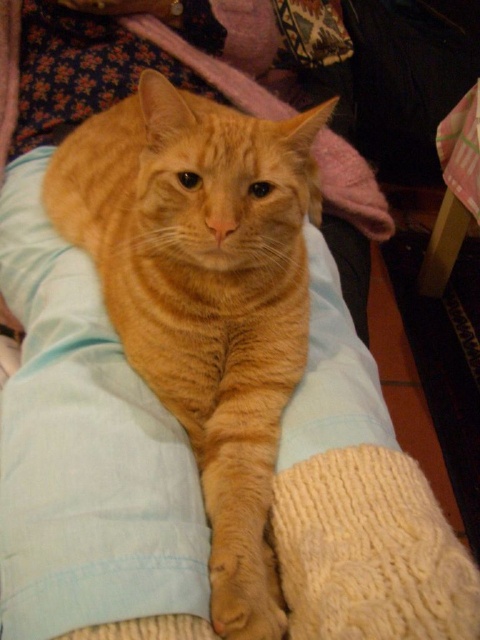
Question: Does orange fur cat at center come in front of light blue fabric pillow at center?

Choices:
 (A) no
 (B) yes

Answer: (A)

Question: Which point is farther to the camera?

Choices:
 (A) (36, 243)
 (B) (206, 323)

Answer: (A)

Question: In this image, where is orange fur cat at center located relative to light blue fabric pillow at center?

Choices:
 (A) above
 (B) below

Answer: (A)

Question: Is orange fur cat at center wider than light blue fabric pillow at center?

Choices:
 (A) yes
 (B) no

Answer: (A)